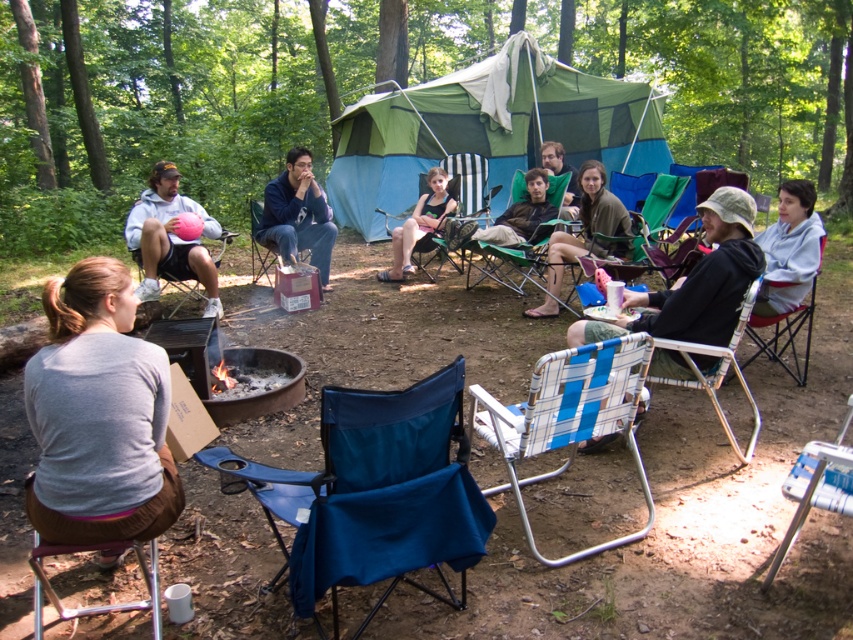
This screenshot has height=640, width=853. What do you see at coordinates (97, 605) in the screenshot? I see `brown fabric chair at lower left` at bounding box center [97, 605].

Where is `brown fabric chair at lower left`? Image resolution: width=853 pixels, height=640 pixels. brown fabric chair at lower left is located at coordinates (97, 605).

Is blue and white striped folding chair at center shorter than brown fabric chair at lower left?

In fact, blue and white striped folding chair at center may be taller than brown fabric chair at lower left.

Which of these two, blue and white striped folding chair at center or brown fabric chair at lower left, stands shorter?

Standing shorter between the two is brown fabric chair at lower left.

Who is more forward, (631,364) or (157,605)?

Point (157,605)

Locate an element on the screen. blue and white striped folding chair at center is located at coordinates (567, 419).

Between matte black jacket at center and metallic silver chair at right, which one is positioned higher?

matte black jacket at center is higher up.

The width and height of the screenshot is (853, 640). I want to click on matte black jacket at center, so click(584, 232).

This screenshot has height=640, width=853. I want to click on matte black jacket at center, so click(x=584, y=232).